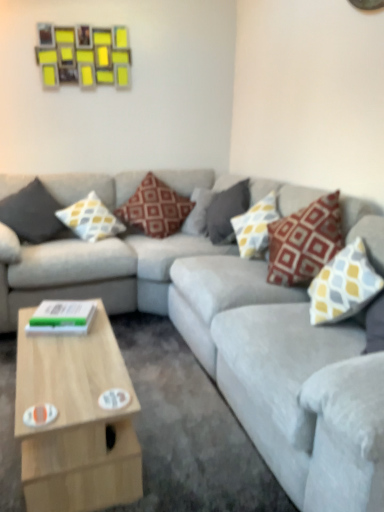
Question: From their relative heights in the image, would you say light wood coffee table at lower left is taller or shorter than brown textured pillow at center, the 4th pillow positioned from the right?

Choices:
 (A) tall
 (B) short

Answer: (B)

Question: Choose the correct answer: Is light wood coffee table at lower left inside brown textured pillow at center, which is the 3th pillow from left to right, or outside it?

Choices:
 (A) inside
 (B) outside

Answer: (B)

Question: Estimate the real-world distances between objects in this image. Which object is closer to the gray fabric pillow at center, which is the fourth pillow from left to right?

Choices:
 (A) dark gray fabric pillow at left, which is the sixth pillow from right to left
 (B) yellow-gray patterned pillow at center, which ranks as the second pillow in right-to-left order
 (C) yellow and gray patterned pillow at upper right, which is the 6th pillow from left to right
 (D) brown textured pillow at center, the 4th pillow positioned from the right
 (E) yellow and gray patterned pillow at center, the second pillow viewed from the left

Answer: (B)

Question: Estimate the real-world distances between objects in this image. Which object is closer to the gray fabric pillow at center, the third pillow when ordered from right to left?

Choices:
 (A) yellow-gray patterned pillow at center, which ranks as the second pillow in right-to-left order
 (B) brown textured pillow at center, which is the 3th pillow from left to right
 (C) light wood coffee table at lower left
 (D) velvet gray couch at center
 (E) yellow and gray patterned pillow at upper right, which is the 6th pillow from left to right

Answer: (A)